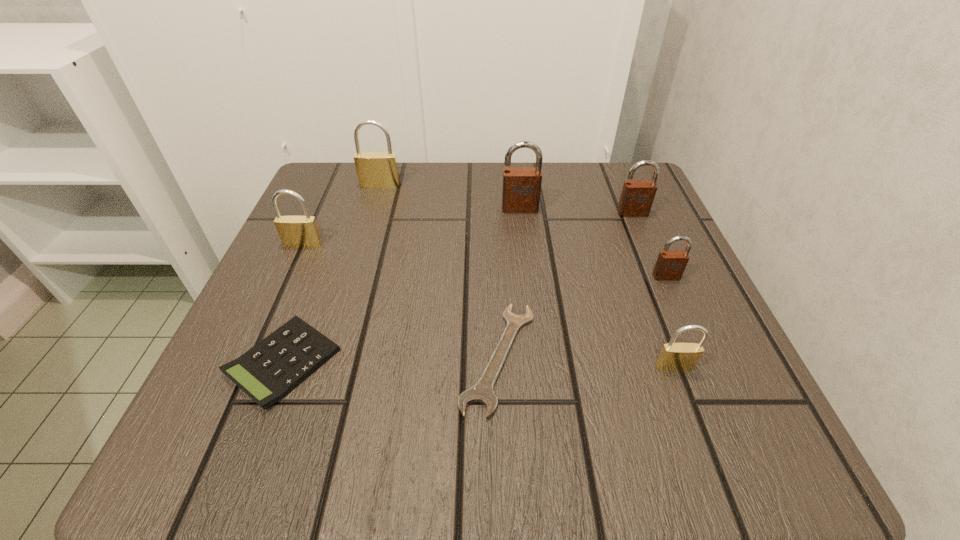
Image resolution: width=960 pixels, height=540 pixels. I want to click on free region located 0.110m on the right of the shortest object, so click(612, 357).

Where is `calculator located in the near edge section of the desktop`? The width and height of the screenshot is (960, 540). calculator located in the near edge section of the desktop is located at coordinates (270, 370).

Where is `wrench that is positioned at the near edge`? wrench that is positioned at the near edge is located at coordinates (482, 392).

Locate an element on the screen. The image size is (960, 540). calculator at the left edge is located at coordinates (270, 370).

At what (x,y) coordinates should I click in order to perform the action: click on object located in the far left corner section of the desktop. Please return your answer as a coordinate pair (x, y). Looking at the image, I should click on point(374,169).

This screenshot has width=960, height=540. What are the coordinates of `object present at the near left corner` in the screenshot? It's located at tap(270, 370).

Where is `object located in the far right corner section of the desktop`? This screenshot has height=540, width=960. object located in the far right corner section of the desktop is located at coordinates (637, 196).

The height and width of the screenshot is (540, 960). Identify the location of free region at the far edge. (412, 190).

This screenshot has height=540, width=960. I want to click on vacant space at the near edge of the desktop, so click(625, 458).

The image size is (960, 540). In order to click on vacant space at the left edge of the desktop in this screenshot , I will do `click(263, 306)`.